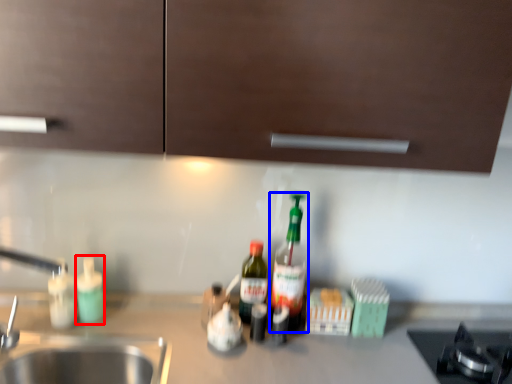
Question: Among these objects, which one is farthest to the camera, bottle (highlighted by a red box) or bottle (highlighted by a blue box)?

Choices:
 (A) bottle
 (B) bottle

Answer: (A)